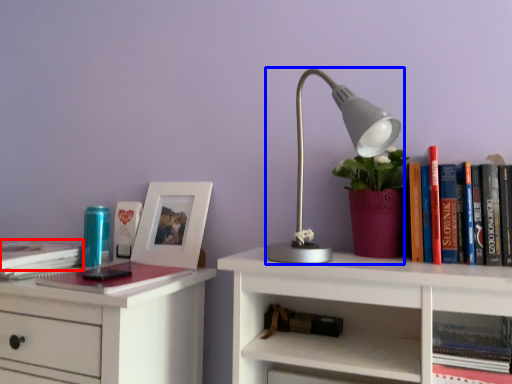
Question: Among these objects, which one is nearest to the camera, book (highlighted by a red box) or lamp (highlighted by a blue box)?

Choices:
 (A) book
 (B) lamp

Answer: (B)